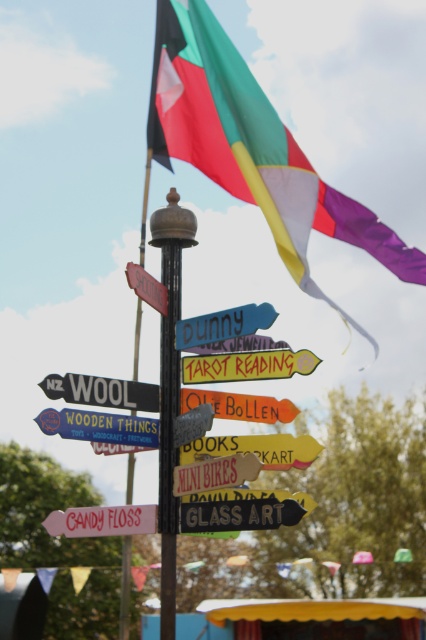
What is located at the coordinates point (x=103, y=520) on the signpost?

The coordinates point (x=103, y=520) on the signpost indicate the pink matte candy floss at lower left.

You are at the fairground and see the wooden sign at center and the black wooden signpost at upper center. Which direction should you look to see both objects in your field of view?

You should look to the right of the black wooden signpost at upper center to see both the wooden sign at center and the black wooden signpost at upper center in your field of view.